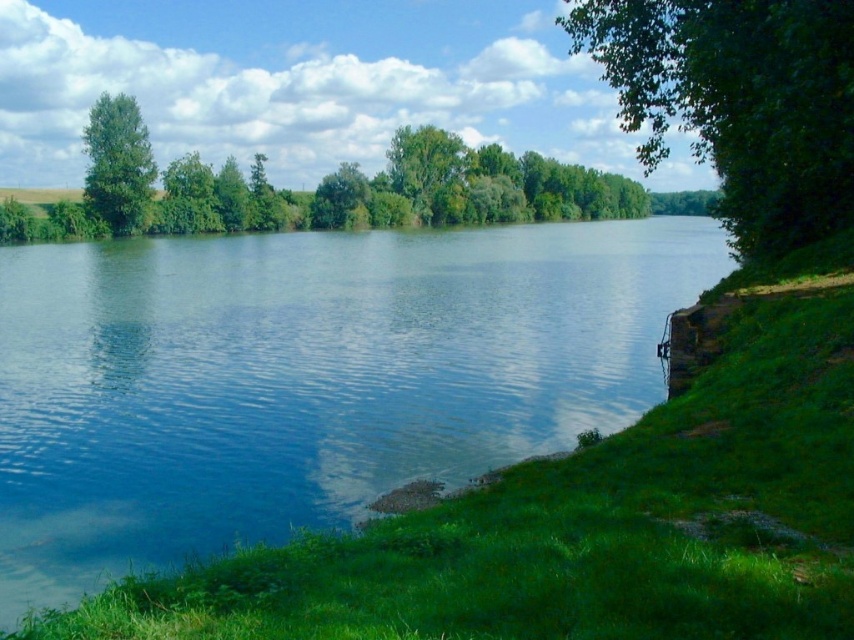
Question: Which of these objects is positioned farthest from the green leafy tree at center?

Choices:
 (A) clear blue water at center
 (B) green leafy tree at upper left

Answer: (A)

Question: Which point is closer to the camera?

Choices:
 (A) (112, 124)
 (B) (159, 291)
 (C) (759, 160)

Answer: (C)

Question: Can you confirm if clear blue water at center is wider than green leafy tree at right?

Choices:
 (A) yes
 (B) no

Answer: (A)

Question: Which of the following is the closest to the observer?

Choices:
 (A) green leafy tree at upper left
 (B) green leafy tree at center

Answer: (A)

Question: Can you confirm if green leafy tree at right is wider than green leafy tree at center?

Choices:
 (A) no
 (B) yes

Answer: (B)

Question: Does clear blue water at center lie behind green leafy tree at center?

Choices:
 (A) yes
 (B) no

Answer: (B)